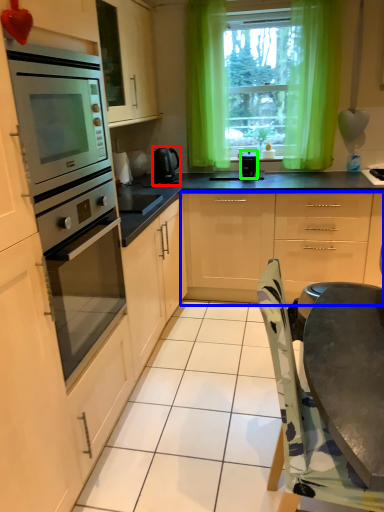
Question: Considering the real-world distances, which object is closest to home appliance (highlighted by a red box)? cabinetry (highlighted by a blue box) or kitchen appliance (highlighted by a green box).

Choices:
 (A) cabinetry
 (B) kitchen appliance

Answer: (B)